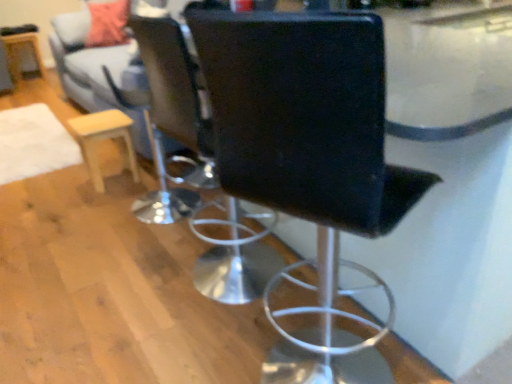
Question: From a real-world perspective, is black leather chair at center, the 2th chair when ordered from back to front, physically above light gray fabric couch at upper left?

Choices:
 (A) yes
 (B) no

Answer: (A)

Question: Can we say black leather chair at center, the 1th chair in the front-to-back sequence, lies outside light gray fabric couch at upper left?

Choices:
 (A) no
 (B) yes

Answer: (B)

Question: Is black leather chair at center, the 2th chair when ordered from back to front, facing away from light gray fabric couch at upper left?

Choices:
 (A) yes
 (B) no

Answer: (B)

Question: Is black leather chair at center, the 2th chair when ordered from back to front, thinner than light gray fabric couch at upper left?

Choices:
 (A) yes
 (B) no

Answer: (A)

Question: From the image's perspective, would you say black leather chair at center, the 2th chair when ordered from back to front, is shown under light gray fabric couch at upper left?

Choices:
 (A) no
 (B) yes

Answer: (B)

Question: Is black leather chair at center, the 1th chair in the front-to-back sequence, shorter than light gray fabric couch at upper left?

Choices:
 (A) yes
 (B) no

Answer: (B)

Question: Can you confirm if light wood/finely finished stool at left is smaller than wooden round table at left?

Choices:
 (A) yes
 (B) no

Answer: (A)

Question: From a real-world perspective, is light wood/finely finished stool at left positioned over wooden round table at left based on gravity?

Choices:
 (A) yes
 (B) no

Answer: (B)

Question: From a real-world perspective, is light wood/finely finished stool at left positioned under wooden round table at left based on gravity?

Choices:
 (A) yes
 (B) no

Answer: (A)

Question: Can you confirm if light wood/finely finished stool at left is positioned to the left of wooden round table at left?

Choices:
 (A) yes
 (B) no

Answer: (B)

Question: Is light wood/finely finished stool at left shorter than wooden round table at left?

Choices:
 (A) yes
 (B) no

Answer: (A)

Question: Is light wood/finely finished stool at left turned away from wooden round table at left?

Choices:
 (A) no
 (B) yes

Answer: (A)

Question: Is black leather chair at center, the 2th chair positioned from the front, oriented towards black leather chair at center, the 1th chair in the front-to-back sequence?

Choices:
 (A) no
 (B) yes

Answer: (A)